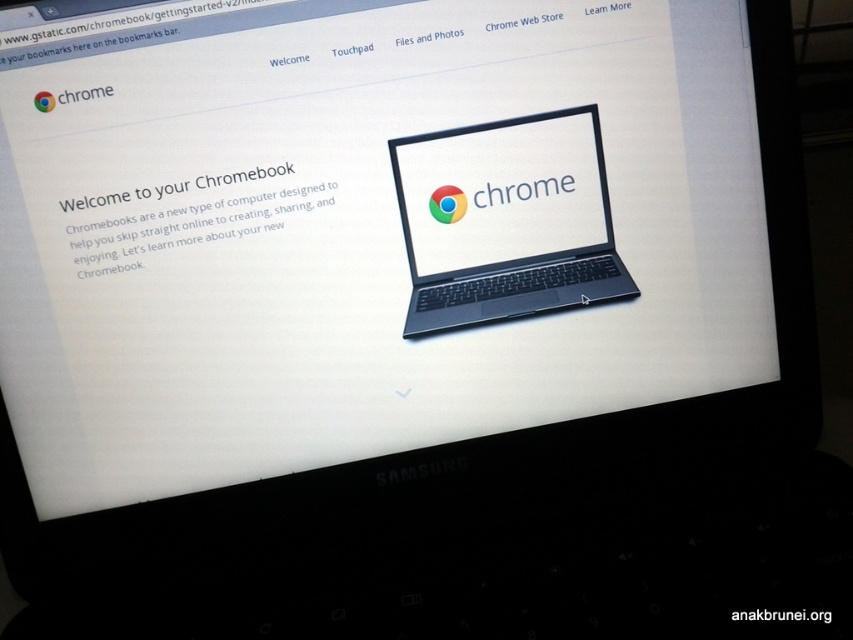
Question: Which point is farther to the camera?

Choices:
 (A) (798, 618)
 (B) (553, 225)

Answer: (B)

Question: Which point appears closest to the camera in this image?

Choices:
 (A) (759, 608)
 (B) (572, 212)

Answer: (A)

Question: Can you confirm if satin black laptop at center is bigger than white glossy laptop at center?

Choices:
 (A) yes
 (B) no

Answer: (A)

Question: Is satin black laptop at center smaller than white glossy laptop at center?

Choices:
 (A) yes
 (B) no

Answer: (B)

Question: Does satin black laptop at center have a lesser width compared to white glossy laptop at center?

Choices:
 (A) no
 (B) yes

Answer: (A)